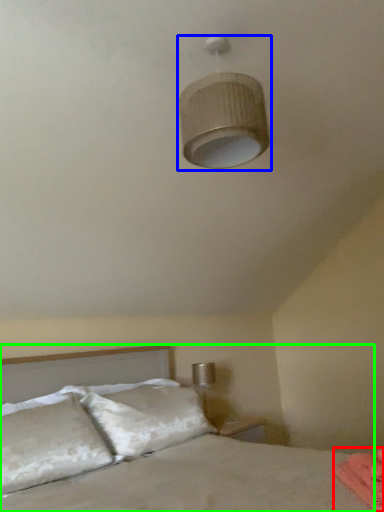
Question: Considering the real-world distances, which object is closest to sheet (highlighted by a red box)? lamp (highlighted by a blue box) or bed (highlighted by a green box).

Choices:
 (A) lamp
 (B) bed

Answer: (B)